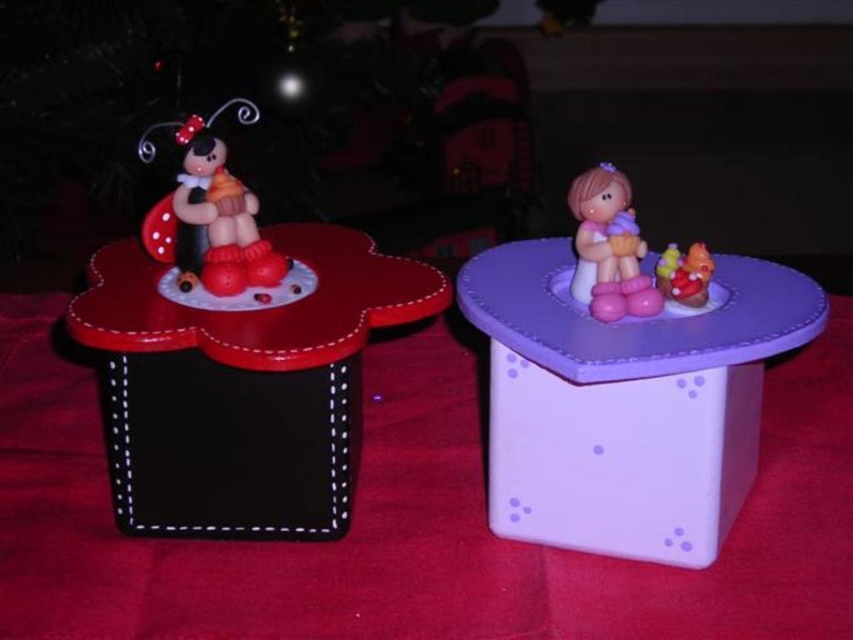
You are standing in front of two miniature tables. You notice two points marked on the scene. The first point is at coordinate point (635,317) and the second is at point (144,134). Which point is closer to you?

Point (635,317) is in front of point (144,134), so it is closer to you.

You are setting up a display and need to arrange two items. You have a matte plastic ladybug at left and a pink rubber duck at upper right. Based on their positions in the image, which item is higher up?

The matte plastic ladybug at left is above the pink rubber duck at upper right, so the matte plastic ladybug at left is higher up.